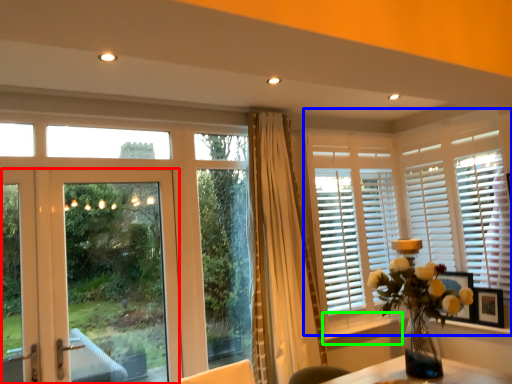
Question: Which object is positioned farthest from door (highlighted by a red box)? Select from window (highlighted by a blue box) and window sill (highlighted by a green box).

Choices:
 (A) window
 (B) window sill

Answer: (A)